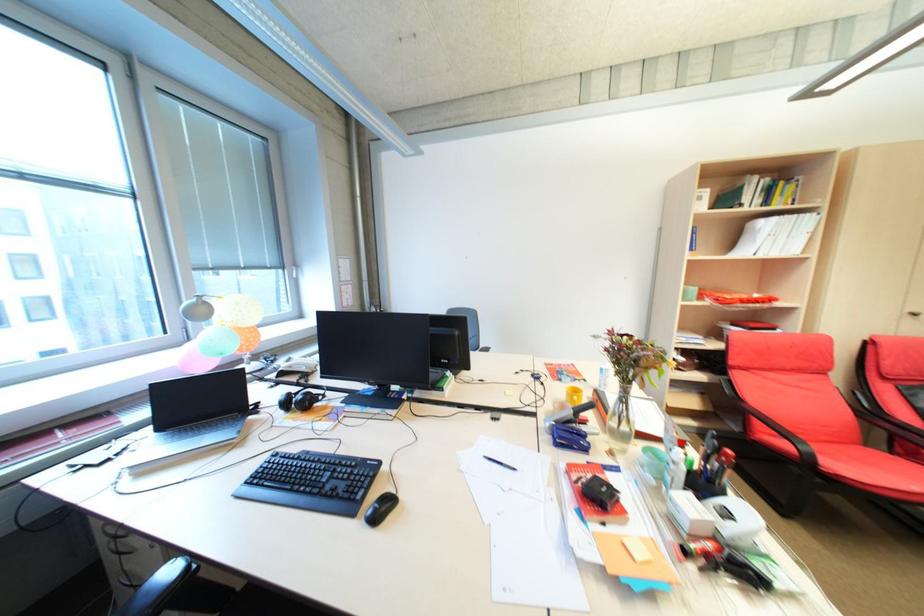
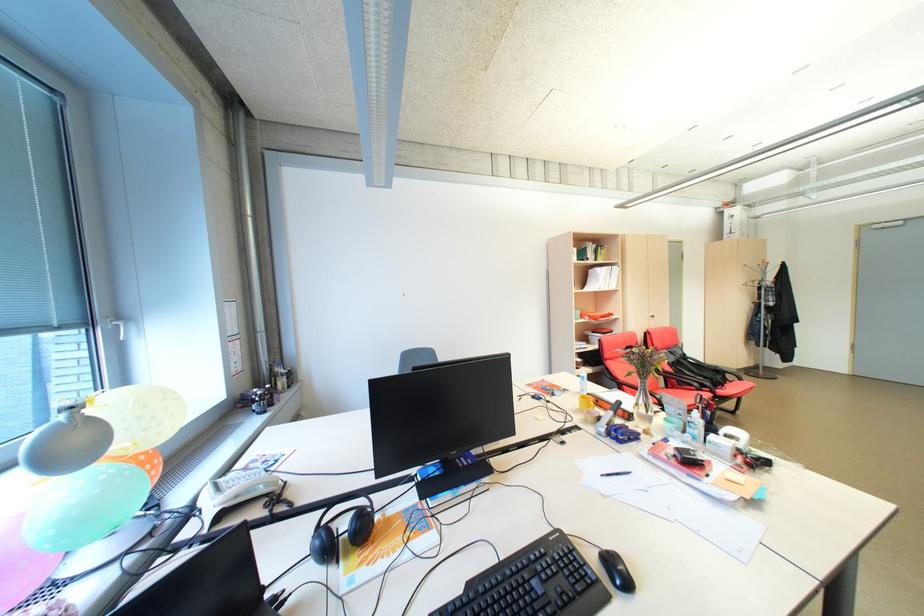
Question: I am providing you with two images of the same scene from different viewpoints. Given a red point in image1, look at the same physical point in image2. Is it:

Choices:
 (A) Closer to the viewpoint
 (B) Farther from the viewpoint

Answer: (B)